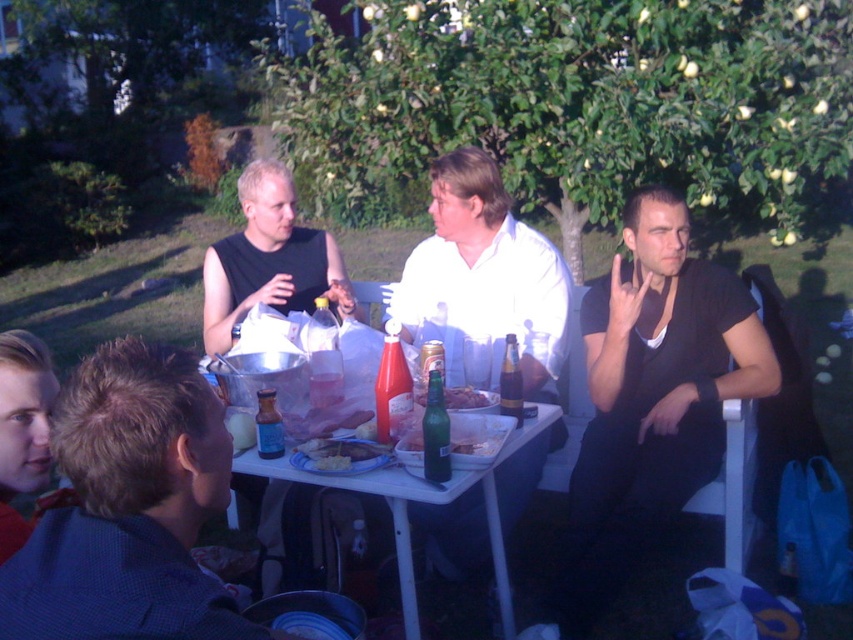
You are sitting at the table and want to grab the shiny plastic bottle at center without moving your chair. Can you reach it easily if the blue glass bottle at table center is blocking your access?

The blue glass bottle at table center is closer to the viewer than the shiny plastic bottle at center, so it is blocking your direct access. You might need to move the blue glass bottle at table center first to reach the shiny plastic bottle at center.

You are one of the guests at the picnic and want to grab a drink. Which bottle is closer to you, the translucent plastic bottle at center or the blue glass bottle at table center?

The translucent plastic bottle at center is closer to you than the blue glass bottle at table center.